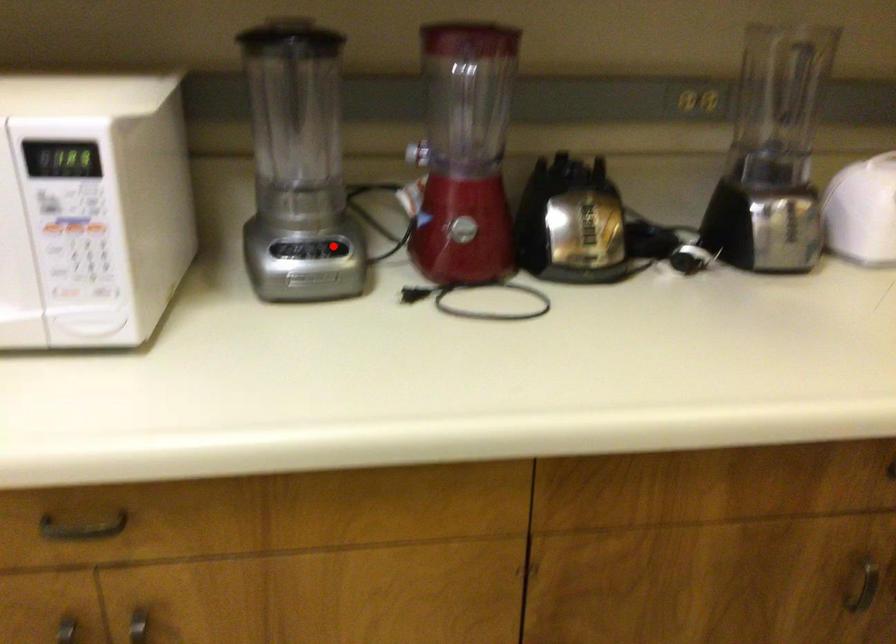
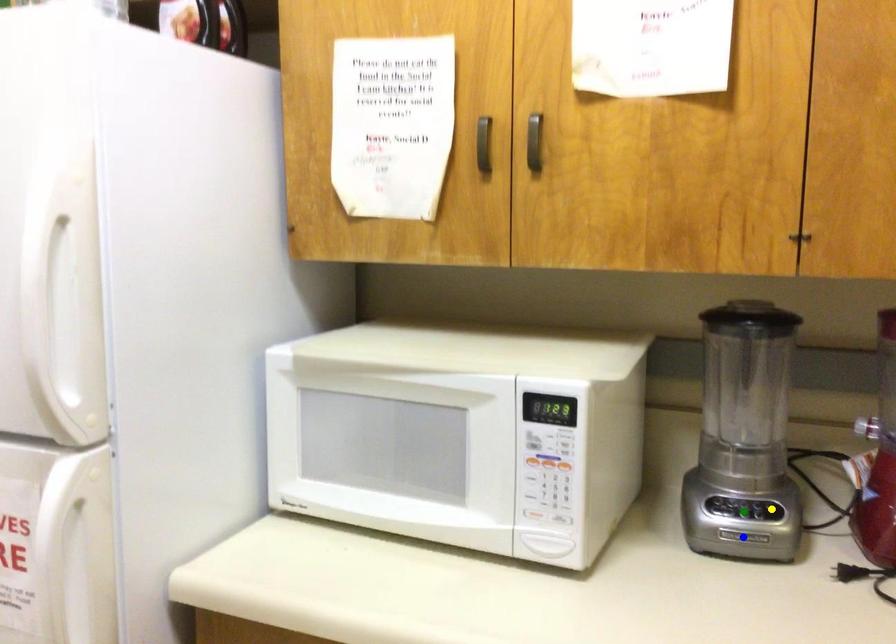
Question: I am providing you with two images of the same scene from different viewpoints. A red point is marked on the first image. You are given multiple points on the second image. Can you choose the point in image 2 that corresponds to the point in image 1?

Choices:
 (A) yellow point
 (B) blue point
 (C) green point

Answer: (A)